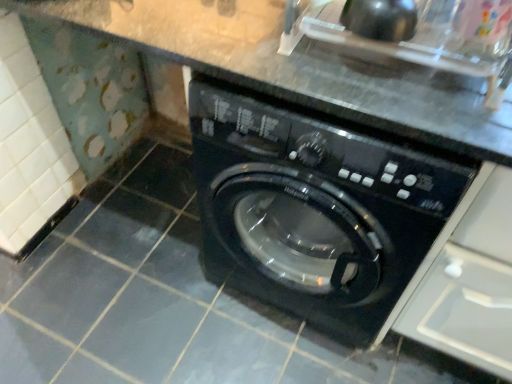
At what (x,y) coordinates should I click in order to perform the action: click on free point to the left of black glossy washing machine at center. Please return your answer as a coordinate pair (x, y). Image resolution: width=512 pixels, height=384 pixels. Looking at the image, I should click on (138, 252).